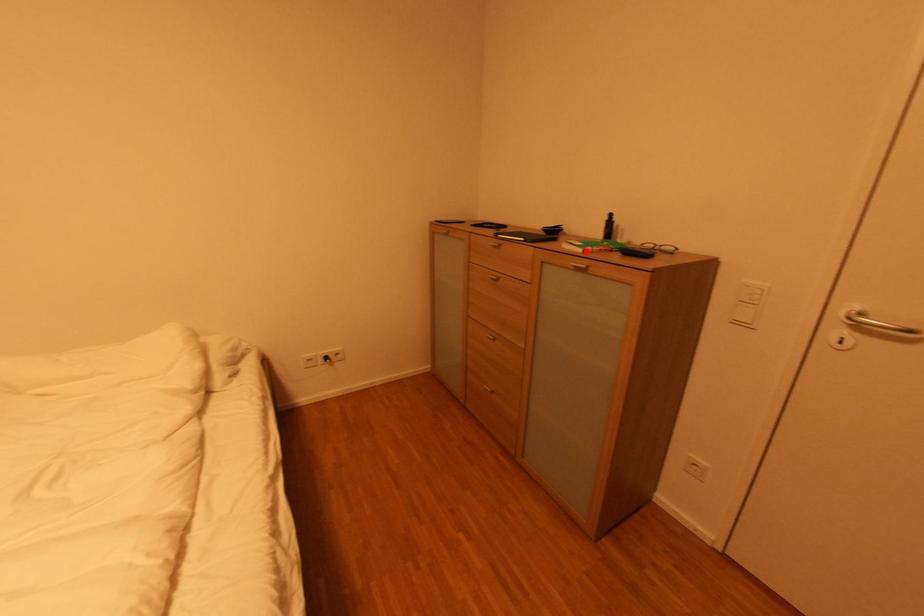
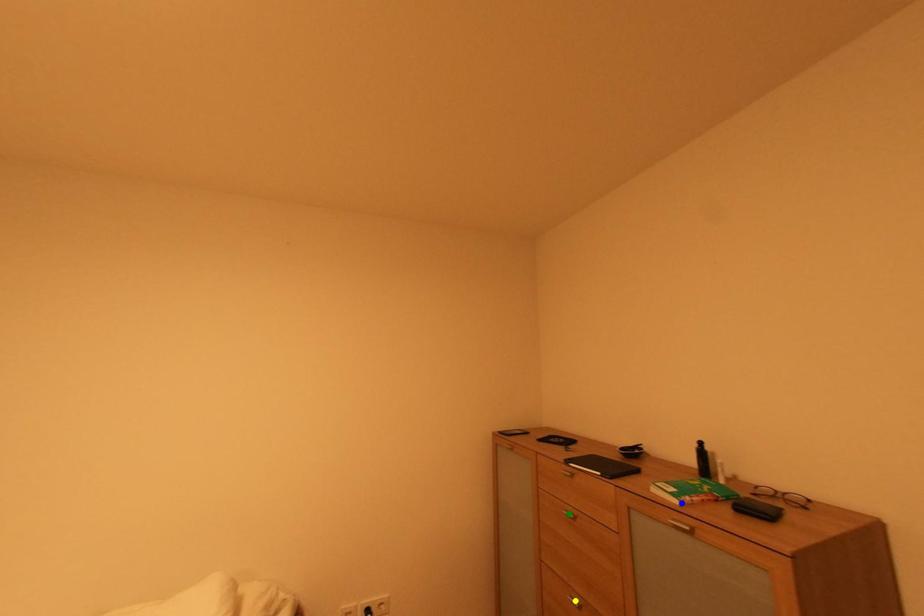
Question: I am providing you with two images of the same scene from different viewpoints. A red point is marked on the first image. You are given multiple points on the second image. Which spot in image 2 lines up with the point in image 1?

Choices:
 (A) yellow point
 (B) green point
 (C) blue point

Answer: (C)